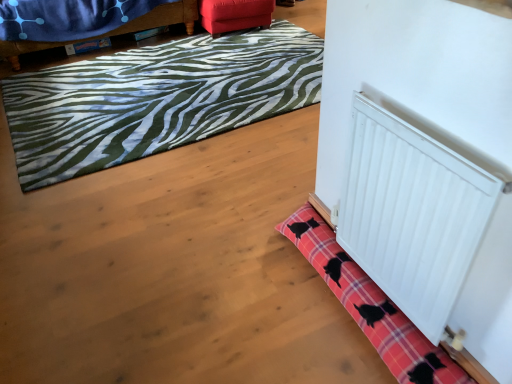
Find the location of `vacant space positioned to the left of pink plaid bath mat at lower right, the 2th bath mat in the back-to-front sequence`. vacant space positioned to the left of pink plaid bath mat at lower right, the 2th bath mat in the back-to-front sequence is located at coordinates pyautogui.click(x=228, y=292).